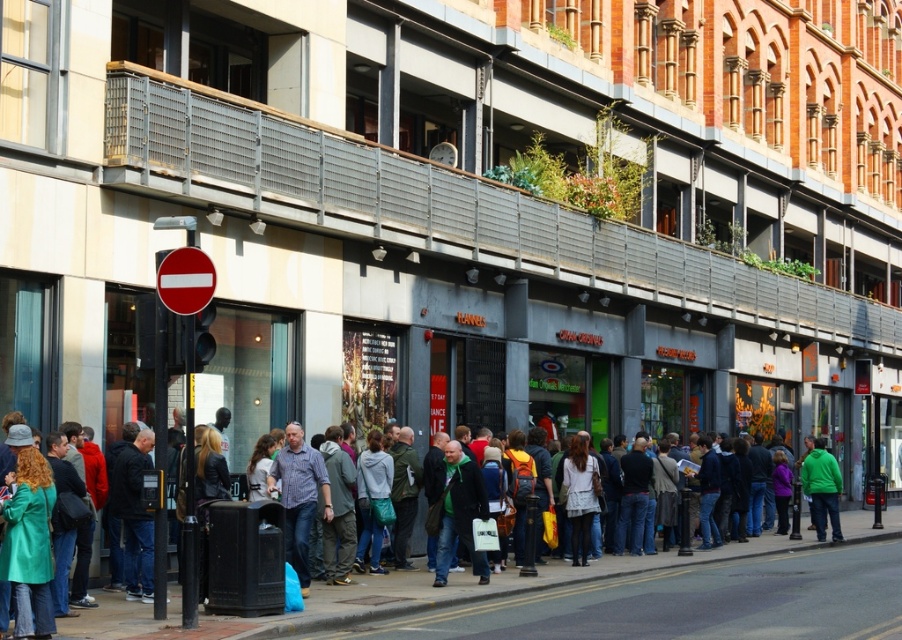
You are standing on the sidewalk in the urban street scene. You notice two points marked in the image. The first point is at coordinate [302,476] and the second is at [822,464]. Which point is closer to your current position?

The point at coordinate [302,476] is closer to your current position because it is closer to the camera than point [822,464].

You are a photographer trying to capture a candid shot of the blue jeans at center and the green fleece jacket at center in the busy street scene. Since you want both subjects to be clearly visible in the frame, which clothing item should you focus on first to ensure it doesn t get cropped out?

The blue jeans at center has a larger size compared to the green fleece jacket at center, so you should focus on capturing the blue jeans at center first to ensure its full size fits within the frame.